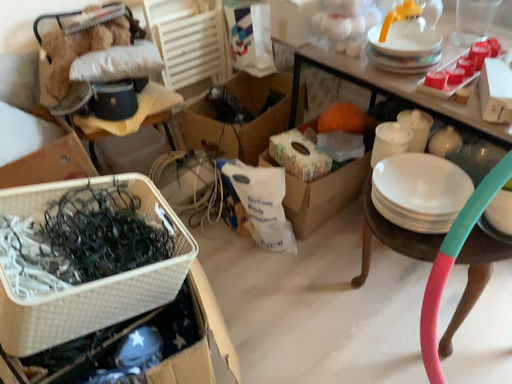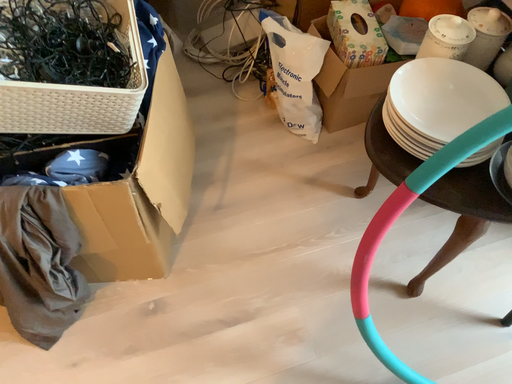
Question: How did the camera likely rotate when shooting the video?

Choices:
 (A) rotated downward
 (B) rotated upward

Answer: (A)